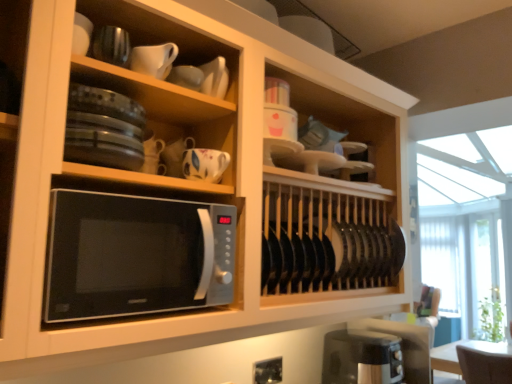
Question: Is sleek silver microwave at center beside white glossy cup at upper center, the 2th tableware from the top?

Choices:
 (A) no
 (B) yes

Answer: (A)

Question: Is sleek silver microwave at center closer to the viewer compared to white glossy cup at upper center, the 2th tableware from the top?

Choices:
 (A) no
 (B) yes

Answer: (B)

Question: Does sleek silver microwave at center lie behind white glossy cup at upper center, marked as the third tableware in a bottom-to-top arrangement?

Choices:
 (A) yes
 (B) no

Answer: (B)

Question: From a real-world perspective, is sleek silver microwave at center on top of white glossy cup at upper center, marked as the third tableware in a bottom-to-top arrangement?

Choices:
 (A) yes
 (B) no

Answer: (B)

Question: From a real-world perspective, is sleek silver microwave at center located beneath white glossy cup at upper center, the 2th tableware from the top?

Choices:
 (A) no
 (B) yes

Answer: (B)

Question: From the image's perspective, does sleek silver microwave at center appear lower than white glossy cup at upper center, marked as the third tableware in a bottom-to-top arrangement?

Choices:
 (A) yes
 (B) no

Answer: (A)

Question: Is black plastic toaster at lower right to the left of white glossy cup at upper center, marked as the third tableware in a bottom-to-top arrangement, from the viewer's perspective?

Choices:
 (A) no
 (B) yes

Answer: (A)

Question: Is black plastic toaster at lower right positioned with its back to white glossy cup at upper center, marked as the third tableware in a bottom-to-top arrangement?

Choices:
 (A) no
 (B) yes

Answer: (A)

Question: Does black plastic toaster at lower right have a lesser height compared to white glossy cup at upper center, the 2th tableware from the top?

Choices:
 (A) no
 (B) yes

Answer: (A)

Question: From the image's perspective, is black plastic toaster at lower right on top of white glossy cup at upper center, marked as the third tableware in a bottom-to-top arrangement?

Choices:
 (A) no
 (B) yes

Answer: (A)

Question: Is black plastic toaster at lower right located outside white glossy cup at upper center, marked as the third tableware in a bottom-to-top arrangement?

Choices:
 (A) yes
 (B) no

Answer: (A)

Question: Are black plastic toaster at lower right and white glossy cup at upper center, the 2th tableware from the top, far apart?

Choices:
 (A) yes
 (B) no

Answer: (A)

Question: Is black plastic toaster at lower right closer to camera compared to white matte pitcher at upper center, which ranks as the 4th tableware in bottom-to-top order?

Choices:
 (A) no
 (B) yes

Answer: (A)